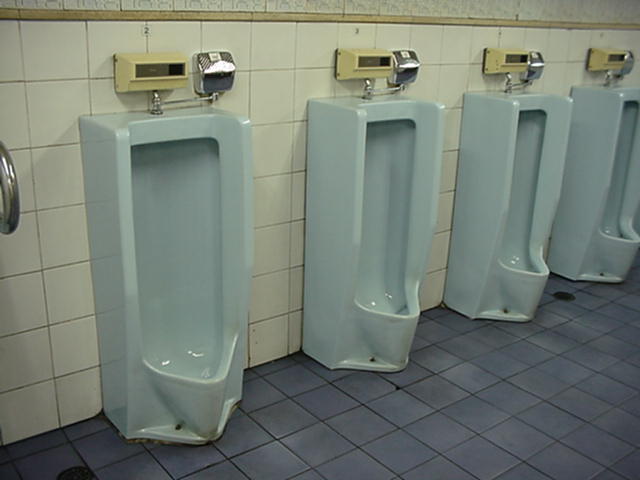
You are a GUI agent. You are given a task and a screenshot of the screen. Output one action in this format:
    pyautogui.click(x=<x>, y=<y>)
    Task: Click on the urinals
    
    Given the screenshot: What is the action you would take?
    pyautogui.click(x=179, y=254), pyautogui.click(x=390, y=227), pyautogui.click(x=516, y=204), pyautogui.click(x=619, y=182)